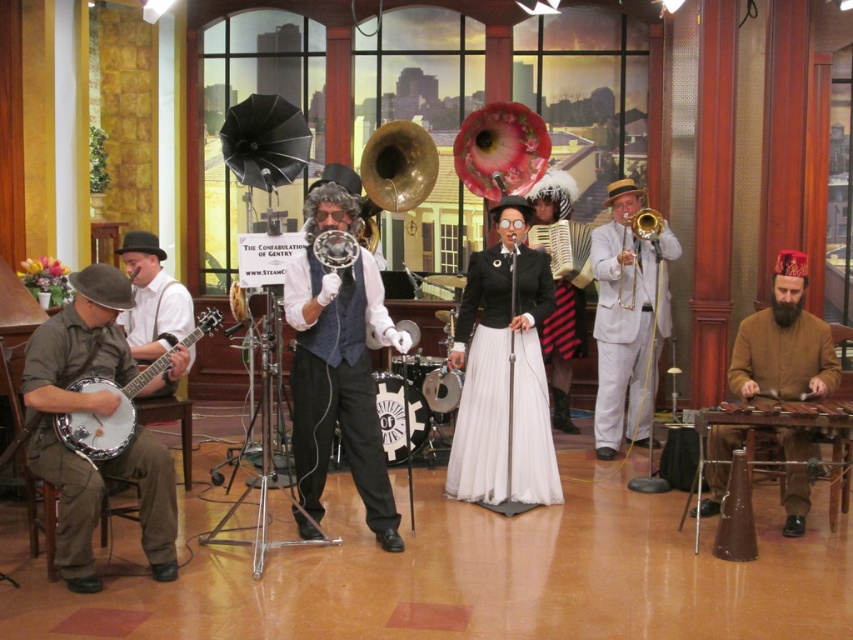
Question: Is brown fabric banjo at left positioned in front of matte brown banjo at left?

Choices:
 (A) no
 (B) yes

Answer: (B)

Question: Is black satin dress at center wider than brown woolen robe at lower right?

Choices:
 (A) no
 (B) yes

Answer: (A)

Question: Which object appears farthest from the camera in this image?

Choices:
 (A) matte brown banjo at left
 (B) brown wooden xylophone at right

Answer: (B)

Question: Is the position of brown fabric banjo at left more distant than that of brown woolen robe at lower right?

Choices:
 (A) no
 (B) yes

Answer: (A)

Question: Which of these objects is positioned closest to the white satin suit at right?

Choices:
 (A) black satin dress at center
 (B) brown wooden xylophone at right
 (C) brown fabric banjo at left

Answer: (A)

Question: Which of the following is the farthest from the observer?

Choices:
 (A) (378, 280)
 (B) (753, 362)
 (C) (543, 502)
 (D) (78, 445)

Answer: (C)